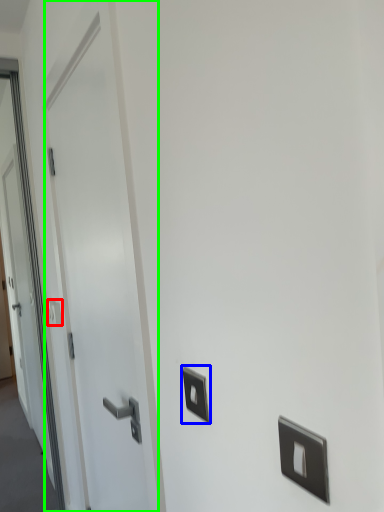
Question: Which is farther away from light switch (highlighted by a red box)? light switch (highlighted by a blue box) or door (highlighted by a green box)?

Choices:
 (A) light switch
 (B) door

Answer: (A)